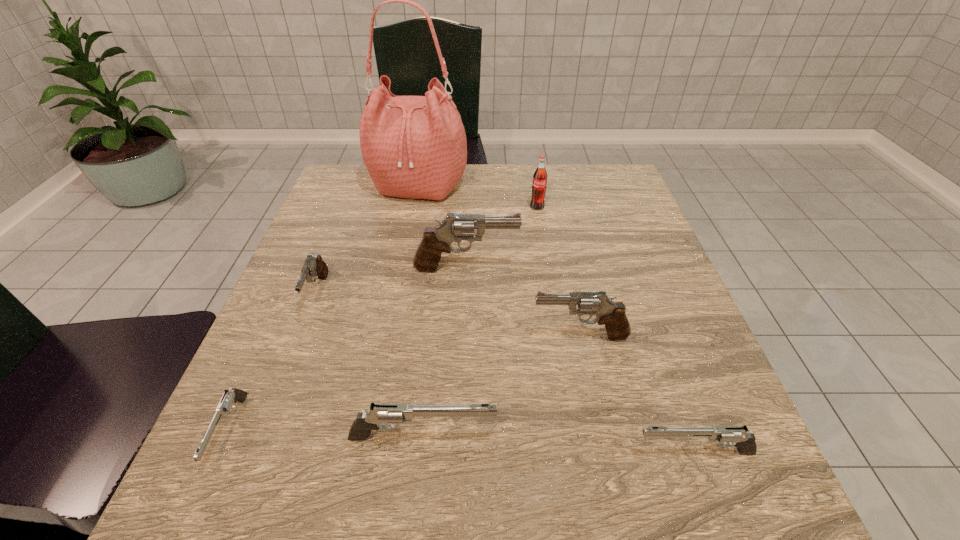
You are a GUI agent. You are given a task and a screenshot of the screen. Output one action in this format:
    pyautogui.click(x=<x>, y=<y>)
    Task: Click on the handbag
    This screenshot has width=960, height=540.
    Given the screenshot: What is the action you would take?
    pyautogui.click(x=415, y=147)

Find the location of `the second gray pistol from right to left`. the second gray pistol from right to left is located at coordinates (436, 240).

At what (x,y) coordinates should I click in order to perform the action: click on the tallest pistol. Please return your answer as a coordinate pair (x, y). Image resolution: width=960 pixels, height=540 pixels. Looking at the image, I should click on (436, 240).

Locate an element on the screen. The height and width of the screenshot is (540, 960). soda bottle is located at coordinates (539, 183).

You are a GUI agent. You are given a task and a screenshot of the screen. Output one action in this format:
    pyautogui.click(x=<x>, y=<y>)
    Task: Click on the fourth nearest object
    This screenshot has height=540, width=960.
    Given the screenshot: What is the action you would take?
    pyautogui.click(x=611, y=314)

Locate an element on the screen. the rightmost gray pistol is located at coordinates (611, 314).

Locate an element on the screen. This screenshot has height=540, width=960. the biggest silver pistol is located at coordinates (396, 413).

Where is `the smallest gray pistol`? The width and height of the screenshot is (960, 540). the smallest gray pistol is located at coordinates (314, 267).

This screenshot has height=540, width=960. What are the coordinates of `the seventh object from right to left` in the screenshot? It's located at (314, 267).

Where is `the fifth tallest pistol`? Image resolution: width=960 pixels, height=540 pixels. the fifth tallest pistol is located at coordinates (x=738, y=436).